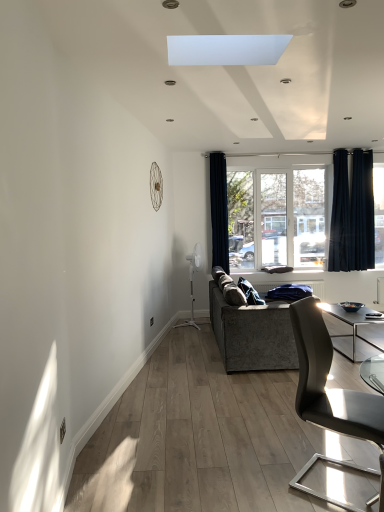
Question: From the image's perspective, would you say black velvet curtain at right, the 3th curtain positioned from the left, is shown under matte black chair at lower right?

Choices:
 (A) no
 (B) yes

Answer: (A)

Question: Does black velvet curtain at right, arranged as the first curtain when viewed from the right, have a larger size compared to matte black chair at lower right?

Choices:
 (A) no
 (B) yes

Answer: (A)

Question: Considering the relative sizes of black velvet curtain at right, the 3th curtain positioned from the left, and matte black chair at lower right in the image provided, is black velvet curtain at right, the 3th curtain positioned from the left, shorter than matte black chair at lower right?

Choices:
 (A) no
 (B) yes

Answer: (A)

Question: Is black velvet curtain at right, arranged as the first curtain when viewed from the right, surrounding matte black chair at lower right?

Choices:
 (A) yes
 (B) no

Answer: (B)

Question: Is black velvet curtain at right, arranged as the first curtain when viewed from the right, facing away from matte black chair at lower right?

Choices:
 (A) yes
 (B) no

Answer: (B)

Question: Is black velvet curtain at right, arranged as the first curtain when viewed from the right, taller or shorter than blue fabric at center?

Choices:
 (A) tall
 (B) short

Answer: (A)

Question: Is black velvet curtain at right, arranged as the first curtain when viewed from the right, in front of or behind blue fabric at center in the image?

Choices:
 (A) behind
 (B) front

Answer: (A)

Question: From the image's perspective, is black velvet curtain at right, arranged as the first curtain when viewed from the right, located above or below blue fabric at center?

Choices:
 (A) above
 (B) below

Answer: (A)

Question: From a real-world perspective, relative to blue fabric at center, is black velvet curtain at right, arranged as the first curtain when viewed from the right, vertically above or below?

Choices:
 (A) above
 (B) below

Answer: (A)

Question: Based on their sizes in the image, would you say dark blue fabric curtain at center, which is counted as the third curtain, starting from the right, is bigger or smaller than textured gray couch at center?

Choices:
 (A) small
 (B) big

Answer: (A)

Question: Relative to textured gray couch at center, is dark blue fabric curtain at center, marked as the 1th curtain in a left-to-right arrangement, in front or behind?

Choices:
 (A) front
 (B) behind

Answer: (B)

Question: In the image, is dark blue fabric curtain at center, marked as the 1th curtain in a left-to-right arrangement, on the left side or the right side of textured gray couch at center?

Choices:
 (A) right
 (B) left

Answer: (B)

Question: Is point (221, 243) positioned closer to the camera than point (215, 326)?

Choices:
 (A) farther
 (B) closer

Answer: (A)

Question: Is textured gray couch at center in front of or behind blue fabric at center in the image?

Choices:
 (A) behind
 (B) front

Answer: (B)

Question: From the image's perspective, is textured gray couch at center above or below blue fabric at center?

Choices:
 (A) below
 (B) above

Answer: (A)